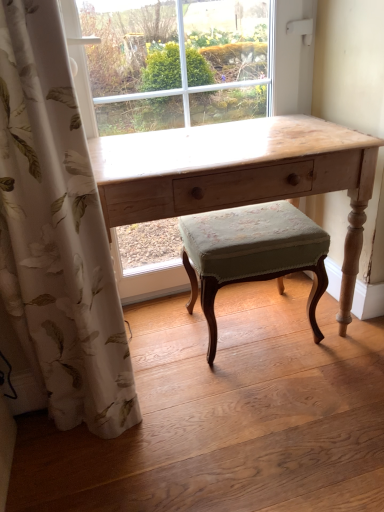
Find the location of `vacant area situated to the left side of green fabric stool at center`. vacant area situated to the left side of green fabric stool at center is located at coordinates (165, 340).